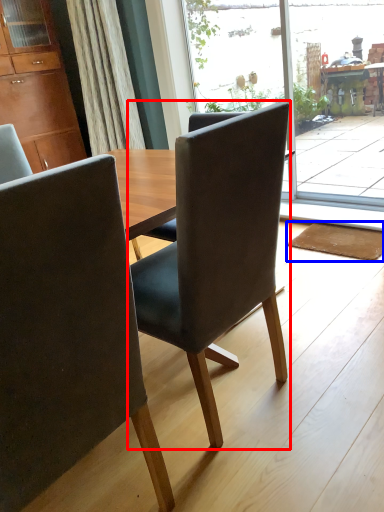
Question: Which object is further to the camera taking this photo, chair (highlighted by a red box) or mat (highlighted by a blue box)?

Choices:
 (A) chair
 (B) mat

Answer: (B)